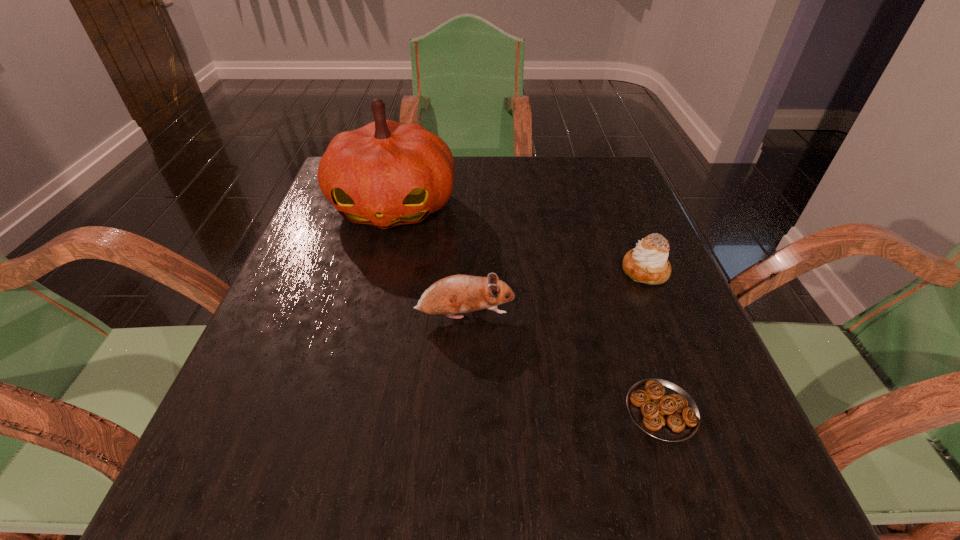
This screenshot has height=540, width=960. Identify the location of the farthest object. (385, 174).

Identify the location of the tallest object. (385, 174).

Where is `hamster`? hamster is located at coordinates (455, 294).

The image size is (960, 540). Find the location of `the second farthest object`. the second farthest object is located at coordinates (647, 263).

At what (x,y) coordinates should I click in order to perform the action: click on the farther pastry. Please return your answer as a coordinate pair (x, y). Image resolution: width=960 pixels, height=540 pixels. Looking at the image, I should click on (647, 263).

Where is `the nearest object`? The image size is (960, 540). the nearest object is located at coordinates (662, 409).

What are the coordinates of `the nearer pastry` in the screenshot? It's located at (662, 409).

I want to click on vacant space situated 0.240m on the front-facing side of the pumpkin, so click(x=362, y=331).

Locate an element on the screen. The width and height of the screenshot is (960, 540). vacant space situated 0.150m at the face of the second nearest object is located at coordinates (598, 316).

Image resolution: width=960 pixels, height=540 pixels. Find the location of `free space located on the front of the taller pastry`. free space located on the front of the taller pastry is located at coordinates (707, 423).